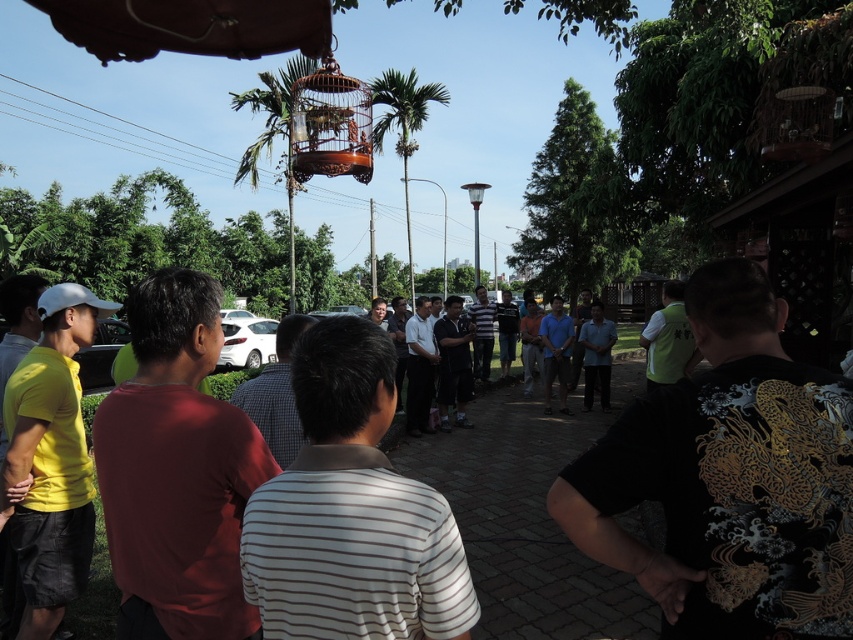
Consider the image. Does wooden birdcage at center appear under white glossy car at center?

Actually, wooden birdcage at center is above white glossy car at center.

Which is in front, point (312, 74) or point (271, 337)?

Point (312, 74) is in front.

At what (x,y) coordinates should I click in order to perform the action: click on wooden birdcage at center. Please return your answer as a coordinate pair (x, y). Looking at the image, I should click on (329, 124).

Is wooden birdcage at center behind green leafy palm tree at upper center?

No.

Does wooden birdcage at center have a lesser width compared to green leafy palm tree at upper center?

Yes.

Is point (343, 147) positioned before point (267, 122)?

Yes, point (343, 147) is closer to viewer.

At what (x,y) coordinates should I click in order to perform the action: click on wooden birdcage at center. Please return your answer as a coordinate pair (x, y). Looking at the image, I should click on (329, 124).

Does green leafy palm tree at upper center appear under green leafy palm tree at center?

Correct, green leafy palm tree at upper center is located below green leafy palm tree at center.

Is green leafy palm tree at upper center wider than green leafy palm tree at center?

Indeed, green leafy palm tree at upper center has a greater width compared to green leafy palm tree at center.

In order to click on green leafy palm tree at upper center in this screenshot , I will do `click(270, 112)`.

At what (x,y) coordinates should I click in order to perform the action: click on green leafy palm tree at upper center. Please return your answer as a coordinate pair (x, y). Looking at the image, I should click on (270, 112).